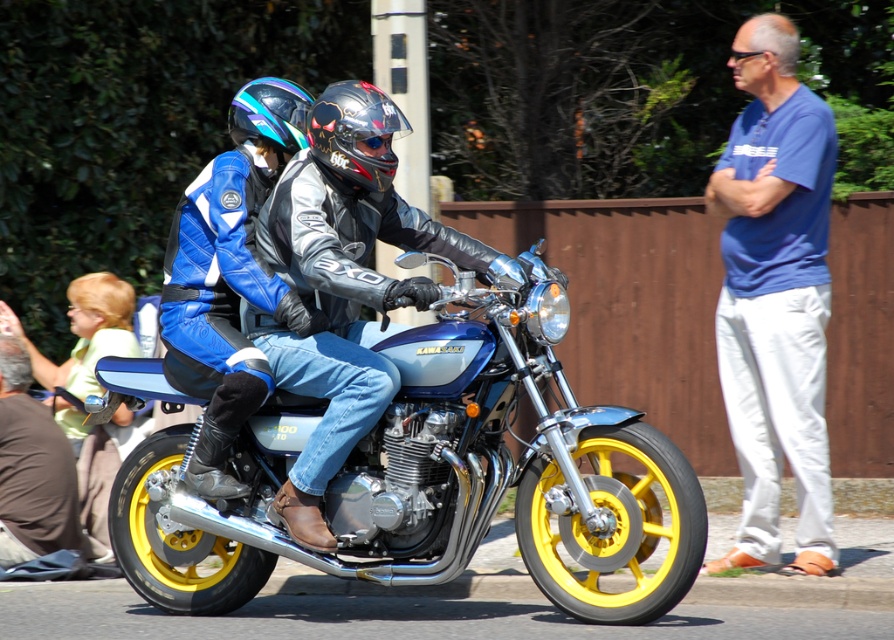
Between shiny black leather jacket at center and brown leather jacket at lower left, which one appears on the right side from the viewer's perspective?

From the viewer's perspective, shiny black leather jacket at center appears more on the right side.

Is shiny black leather jacket at center to the right of brown leather jacket at lower left from the viewer's perspective?

Correct, you'll find shiny black leather jacket at center to the right of brown leather jacket at lower left.

Which is in front, point (314, 548) or point (58, 442)?

Point (314, 548)

Identify the location of shiny black leather jacket at center. The image size is (894, 640). (344, 284).

Can you confirm if shiny metallic motorcycle at center is bigger than shiny blue and white helmet at upper left?

Yes, shiny metallic motorcycle at center is bigger than shiny blue and white helmet at upper left.

Does shiny metallic motorcycle at center appear under shiny blue and white helmet at upper left?

Correct, shiny metallic motorcycle at center is located below shiny blue and white helmet at upper left.

Based on the photo, measure the distance between shiny metallic motorcycle at center and camera.

The distance of shiny metallic motorcycle at center from camera is 7.21 meters.

Identify the location of shiny metallic motorcycle at center. This screenshot has width=894, height=640. (436, 477).

Is point (162, 541) positioned in front of point (335, 99)?

That is False.

Locate an element on the screen. shiny metallic motorcycle at center is located at coordinates (436, 477).